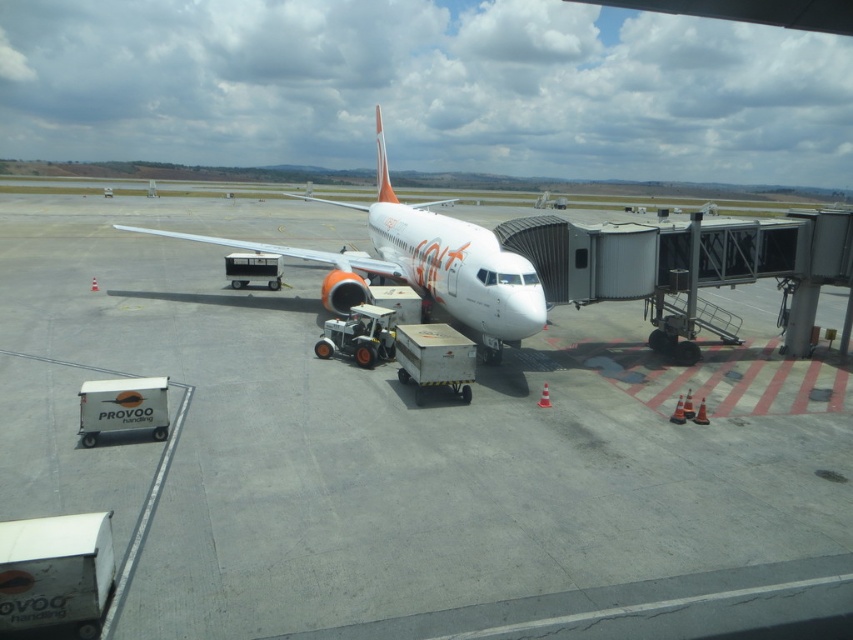
Is white smooth tarmac at center behind white glossy airplane at center?

No, it is in front of white glossy airplane at center.

Does white smooth tarmac at center have a lesser width compared to white glossy airplane at center?

Incorrect, white smooth tarmac at center's width is not less than white glossy airplane at center's.

Measure the distance between point (103, 224) and camera.

Point (103, 224) is 33.64 meters away from camera.

In order to click on white smooth tarmac at center in this screenshot , I will do `click(401, 448)`.